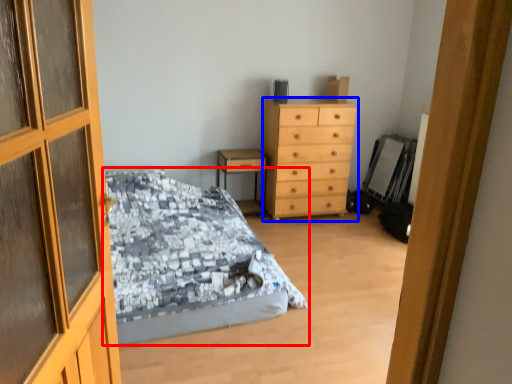
Question: Which of the following is the closest to the observer, bed (highlighted by a red box) or chest of drawers (highlighted by a blue box)?

Choices:
 (A) bed
 (B) chest of drawers

Answer: (A)